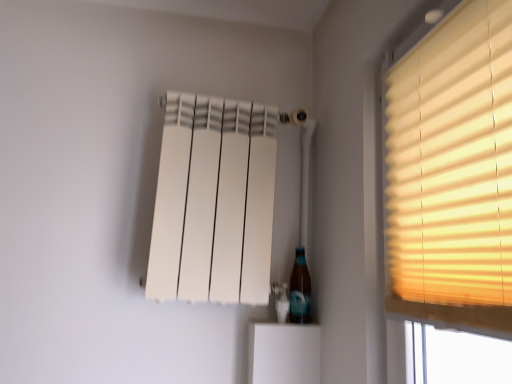
Question: From the image's perspective, relative to white matte radiator at upper center, is translucent glass bottle at lower right above or below?

Choices:
 (A) below
 (B) above

Answer: (A)

Question: From a real-world perspective, relative to white matte radiator at upper center, is translucent glass bottle at lower right vertically above or below?

Choices:
 (A) below
 (B) above

Answer: (A)

Question: Which of these objects is positioned farthest from the matte yellow blinds at right?

Choices:
 (A) translucent glass bottle at lower right
 (B) white matte radiator at upper center

Answer: (A)

Question: Which object is the farthest from the white matte radiator at upper center?

Choices:
 (A) matte yellow blinds at right
 (B) translucent glass bottle at lower right

Answer: (A)